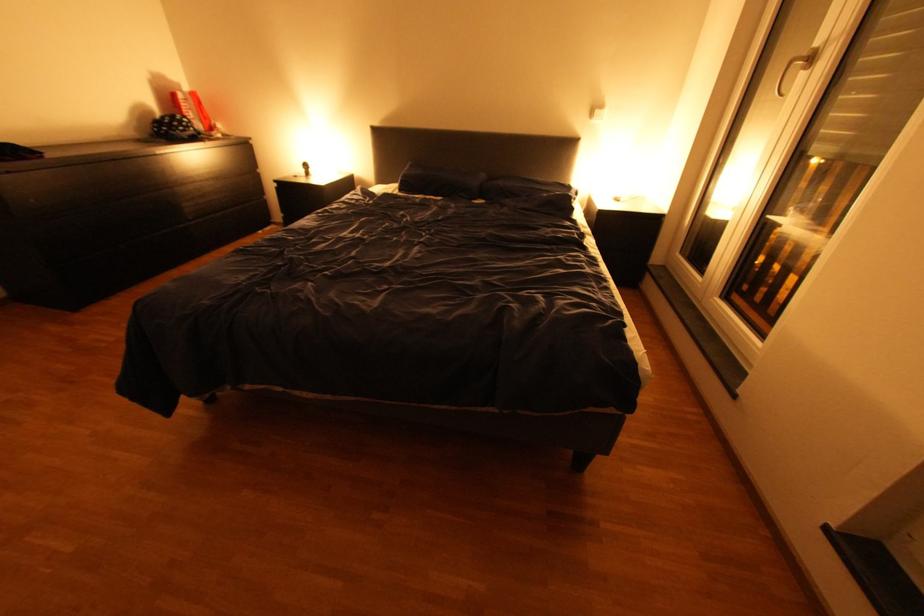
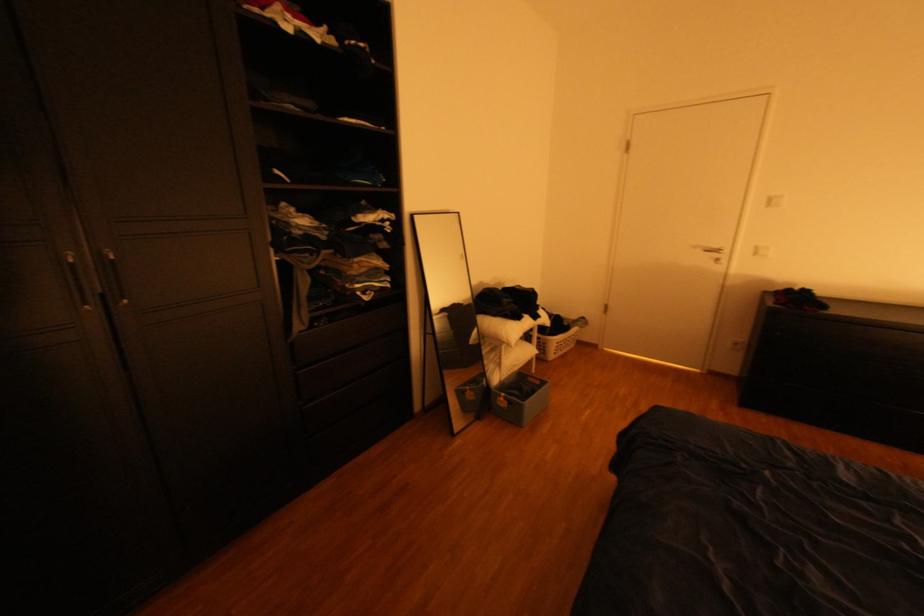
The first image is from the beginning of the video and the second image is from the end. How did the camera likely rotate when shooting the video?

The camera's rotation is toward left-down.